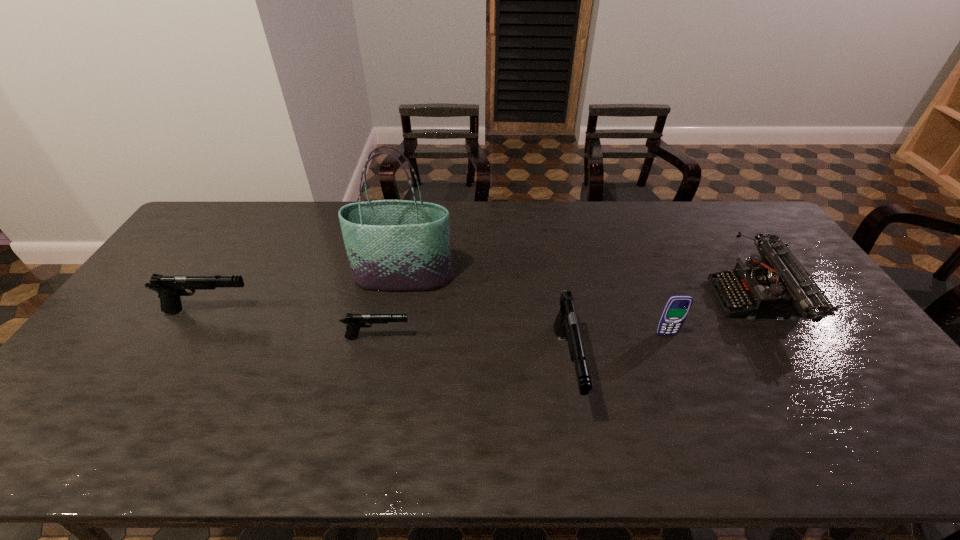
This screenshot has height=540, width=960. In order to click on the second shortest gun in this screenshot , I will do `click(169, 287)`.

In order to click on the farthest gun in this screenshot , I will do `click(169, 287)`.

Find the location of a particular element. the shortest gun is located at coordinates (354, 322).

This screenshot has width=960, height=540. Identify the location of the second gun from left to right. (354, 322).

You are a GUI agent. You are given a task and a screenshot of the screen. Output one action in this format:
    pyautogui.click(x=<x>, y=<y>)
    Task: Click on the third object from right to left
    The height and width of the screenshot is (540, 960).
    Given the screenshot: What is the action you would take?
    [x=566, y=324]

Where is `cellular telephone`? cellular telephone is located at coordinates (677, 307).

Where is `the tallest object`? The image size is (960, 540). the tallest object is located at coordinates (392, 245).

Find the location of `the rightmost object`. the rightmost object is located at coordinates (774, 285).

This screenshot has height=540, width=960. In order to click on vacant point located 0.240m at the aiming end of the leftmost object in this screenshot , I will do `click(338, 311)`.

This screenshot has height=540, width=960. Find the location of `vacant space located at the aiming end of the shortest object`. vacant space located at the aiming end of the shortest object is located at coordinates (483, 338).